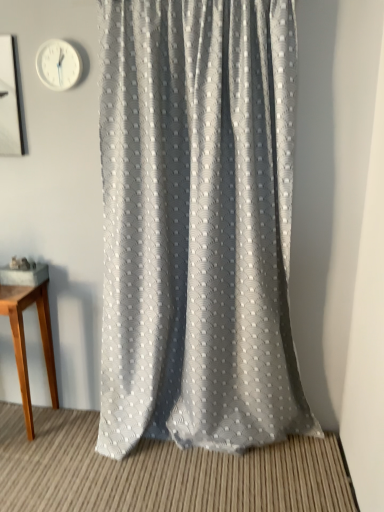
Identify the location of free space between textured gray curtain at center and light brown wooden table at left. The width and height of the screenshot is (384, 512). (69, 432).